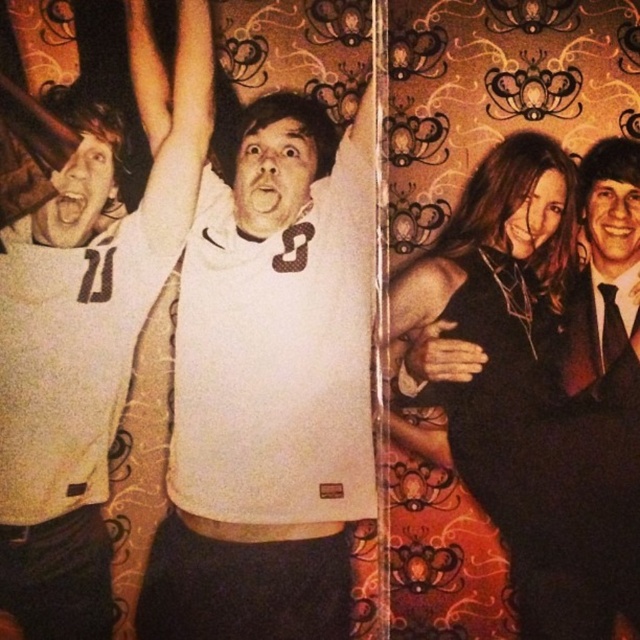
Does black satin dress at center appear over black satin suit at right?

Actually, black satin dress at center is below black satin suit at right.

Can you confirm if black satin dress at center is shorter than black satin suit at right?

No, black satin dress at center is not shorter than black satin suit at right.

Between point (524, 525) and point (604, 376), which one is positioned behind?

The point (604, 376) is more distant.

Where is `black satin dress at center`? black satin dress at center is located at coordinates (529, 392).

Between black satin dress at center and white jersey at left, which one appears on the left side from the viewer's perspective?

From the viewer's perspective, white jersey at left appears more on the left side.

Can you confirm if black satin dress at center is positioned to the right of white jersey at left?

Yes, black satin dress at center is to the right of white jersey at left.

Does point (532, 189) come behind point (88, 563)?

Yes.

What are the coordinates of `black satin dress at center` in the screenshot? It's located at (529, 392).

Which is more to the left, white matte jersey at center or white jersey at left?

white jersey at left

Locate an element on the screen. white matte jersey at center is located at coordinates (269, 387).

The width and height of the screenshot is (640, 640). I want to click on white matte jersey at center, so click(269, 387).

Where is `white matte jersey at center`? The width and height of the screenshot is (640, 640). white matte jersey at center is located at coordinates (269, 387).